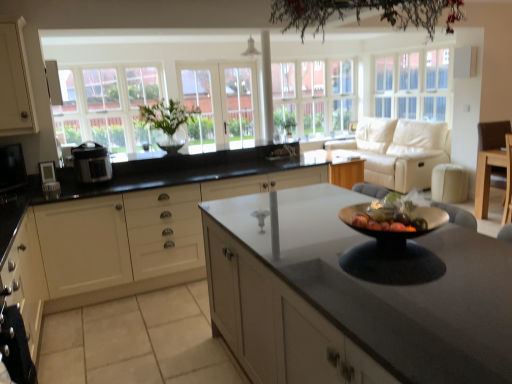
Question: From a real-world perspective, is light brown wood chair at right positioned above or below clear glass window at center, which is the second window from left to right?

Choices:
 (A) below
 (B) above

Answer: (A)

Question: Considering the positions of point (479, 192) and point (297, 109), is point (479, 192) closer or farther from the camera than point (297, 109)?

Choices:
 (A) farther
 (B) closer

Answer: (B)

Question: Considering the real-world distances, which object is closest to the green leafy plant at center?

Choices:
 (A) white matte cabinet at center, acting as the 1th cabinetry starting from the right
 (B) satin black pressure cooker at left, the second appliance when ordered from left to right
 (C) clear glass door at center, which is counted as the second glass door, starting from the left
 (D) matte black microwave at left, the 1th appliance when ordered from left to right
 (E) light brown wood chair at right

Answer: (C)

Question: Which of these objects is positioned farthest from the beige leather couch at upper right?

Choices:
 (A) white matte cabinet at left, the 1th cabinetry positioned from the left
 (B) white glass window at upper right, acting as the 1th window starting from the right
 (C) white glass window at left, arranged as the third window when viewed from the right
 (D) satin black pressure cooker at left, the second appliance when ordered from left to right
 (E) green leafy plant at center

Answer: (A)